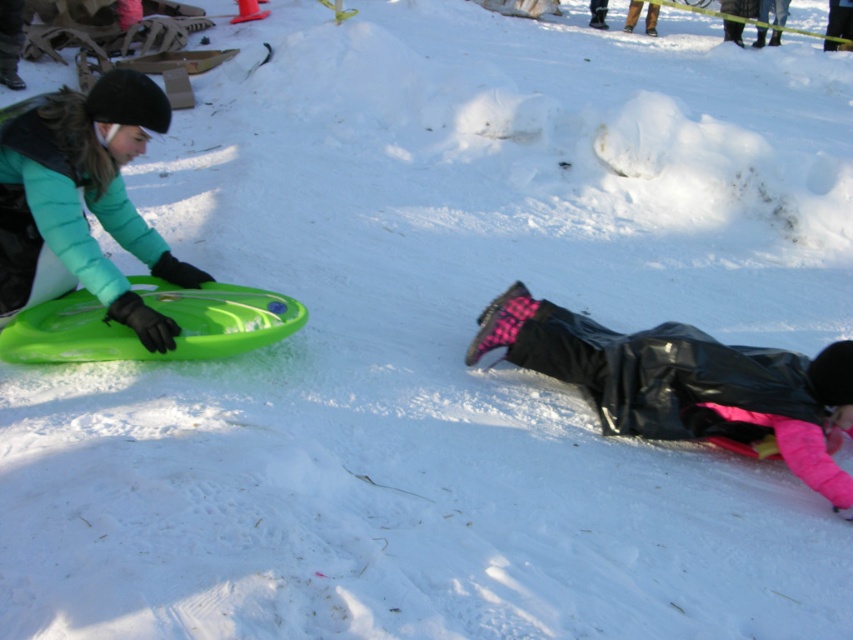
Question: Observing the image, what is the correct spatial positioning of black rubber pants at lower right in reference to green matte sled at left?

Choices:
 (A) right
 (B) left

Answer: (A)

Question: Is the position of black rubber pants at lower right more distant than that of green matte sled at left?

Choices:
 (A) yes
 (B) no

Answer: (B)

Question: Which point is farther to the camera?

Choices:
 (A) black rubber pants at lower right
 (B) green matte sled at left

Answer: (B)

Question: Can you confirm if black rubber pants at lower right is positioned to the right of green matte sled at left?

Choices:
 (A) yes
 (B) no

Answer: (A)

Question: Which object is farther from the camera taking this photo?

Choices:
 (A) green matte sled at left
 (B) black rubber pants at lower right

Answer: (A)